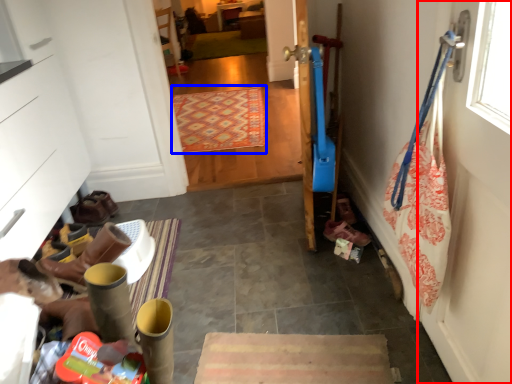
Question: Which object appears farthest to the camera in this image, door (highlighted by a red box) or mat (highlighted by a blue box)?

Choices:
 (A) door
 (B) mat

Answer: (B)